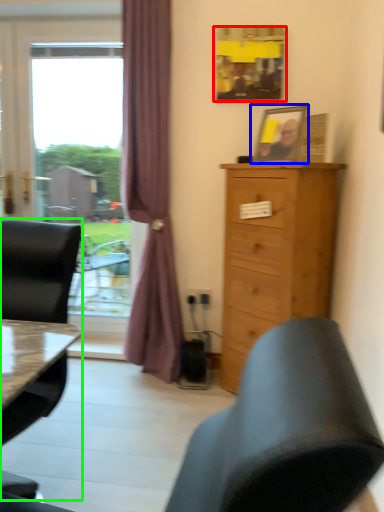
Question: Which is farther away from picture frame (highlighted by a red box)? picture frame (highlighted by a blue box) or chair (highlighted by a green box)?

Choices:
 (A) picture frame
 (B) chair

Answer: (B)